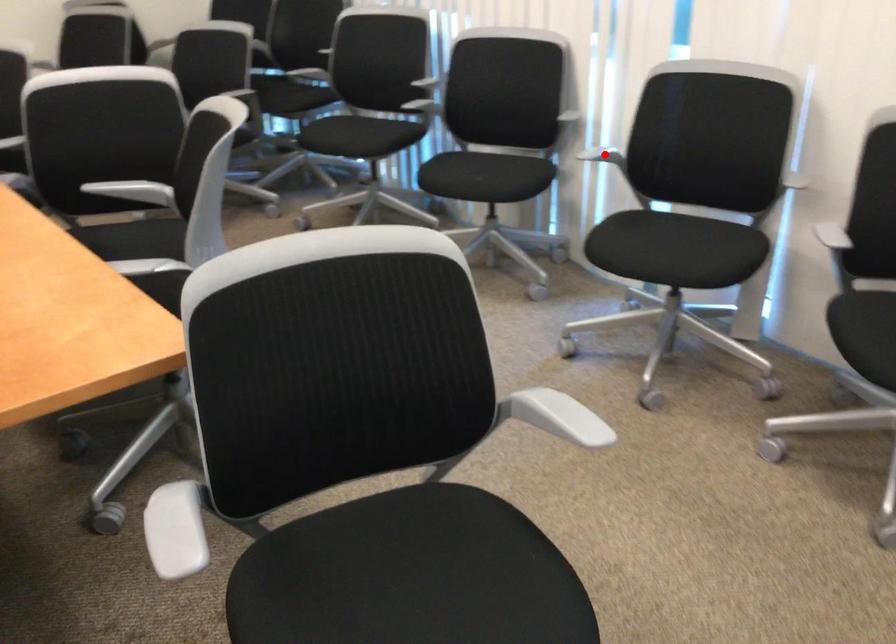
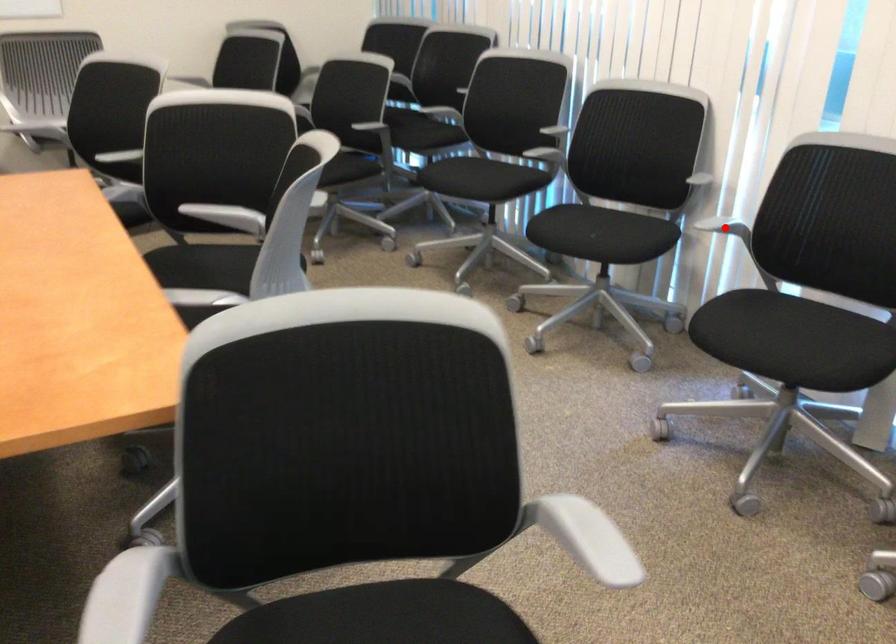
I am providing you with two images of the same scene from different viewpoints. A red point is marked on the first image and another point is marked on the second image. Does the point marked in image1 correspond to the same location as the one in image2?

Yes